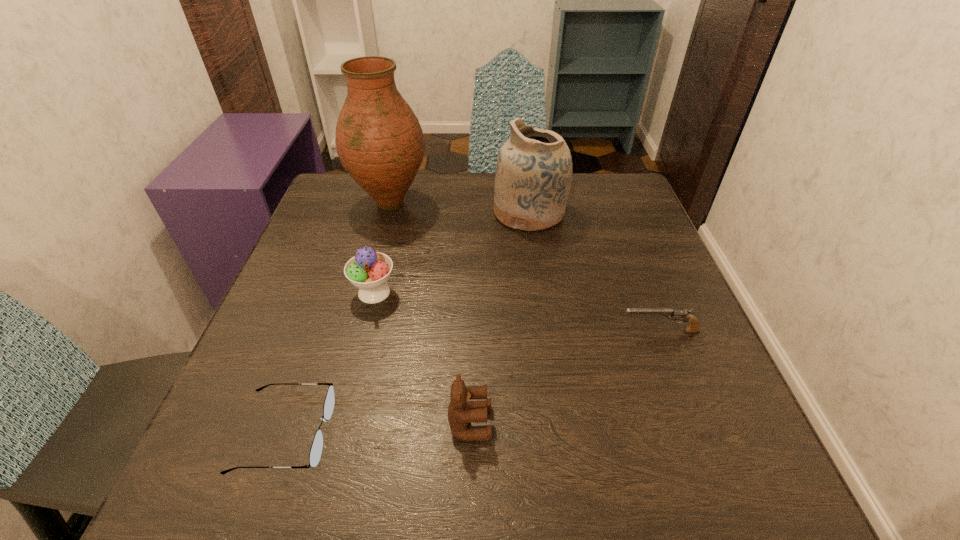
In the image, there is a desktop. At what (x,y) coordinates should I click in order to perform the action: click on blank space at the far left corner. Please return your answer as a coordinate pair (x, y). This screenshot has height=540, width=960. Looking at the image, I should click on (348, 213).

Locate an element on the screen. The width and height of the screenshot is (960, 540). free point at the near left corner is located at coordinates (243, 491).

Locate an element on the screen. vacant space that is in between the tallest object and the fourth nearest object is located at coordinates (382, 248).

At what (x,y) coordinates should I click in order to perform the action: click on vacant area between the fifth object from left to right and the shortest object. Please return your answer as a coordinate pair (x, y). The image size is (960, 540). Looking at the image, I should click on (408, 323).

Find the location of a particular element. empty space that is in between the icecream and the rightmost object is located at coordinates (516, 312).

This screenshot has width=960, height=540. Identify the location of vacant area that lies between the second tallest object and the shortest object. (408, 323).

Locate an element on the screen. The width and height of the screenshot is (960, 540). empty space between the gun and the vase is located at coordinates tap(525, 267).

I want to click on empty location between the fourth object from left to right and the pottery, so [x=500, y=318].

This screenshot has height=540, width=960. I want to click on empty space between the fifth object from left to right and the shortest object, so click(x=408, y=323).

Locate an element on the screen. Image resolution: width=960 pixels, height=540 pixels. free spot between the vase and the icecream is located at coordinates (382, 248).